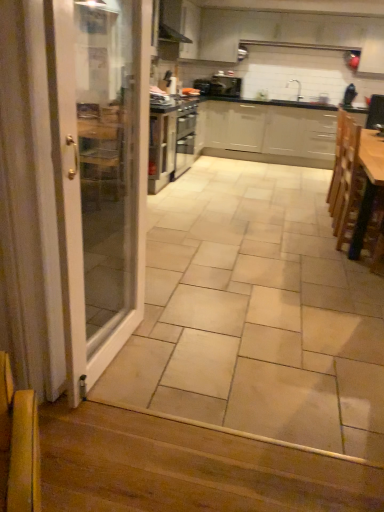
Question: Considering the relative sizes of black matte exhaust hood at upper center and wooden at lower left in the image provided, is black matte exhaust hood at upper center taller than wooden at lower left?

Choices:
 (A) no
 (B) yes

Answer: (B)

Question: Is black matte exhaust hood at upper center not inside wooden at lower left?

Choices:
 (A) no
 (B) yes

Answer: (B)

Question: Is black matte exhaust hood at upper center bigger than wooden at lower left?

Choices:
 (A) no
 (B) yes

Answer: (B)

Question: Is black matte exhaust hood at upper center next to wooden at lower left and touching it?

Choices:
 (A) no
 (B) yes

Answer: (A)

Question: Is black matte exhaust hood at upper center far from wooden at lower left?

Choices:
 (A) no
 (B) yes

Answer: (B)

Question: From their relative heights in the image, would you say beige ceramic tile at center is taller or shorter than wooden armchair at lower left?

Choices:
 (A) short
 (B) tall

Answer: (A)

Question: From the image's perspective, is beige ceramic tile at center positioned above or below wooden armchair at lower left?

Choices:
 (A) above
 (B) below

Answer: (A)

Question: Does point (370, 356) appear closer or farther from the camera than point (23, 437)?

Choices:
 (A) farther
 (B) closer

Answer: (A)

Question: Considering the positions of beige ceramic tile at center and wooden armchair at lower left in the image, is beige ceramic tile at center wider or thinner than wooden armchair at lower left?

Choices:
 (A) thin
 (B) wide

Answer: (B)

Question: Considering the positions of wooden armchair at lower left and black matte exhaust hood at upper center in the image, is wooden armchair at lower left taller or shorter than black matte exhaust hood at upper center?

Choices:
 (A) tall
 (B) short

Answer: (B)

Question: From the image's perspective, relative to black matte exhaust hood at upper center, is wooden armchair at lower left above or below?

Choices:
 (A) above
 (B) below

Answer: (B)

Question: Looking at the image, does wooden armchair at lower left seem bigger or smaller compared to black matte exhaust hood at upper center?

Choices:
 (A) small
 (B) big

Answer: (A)

Question: Considering the positions of wooden armchair at lower left and black matte exhaust hood at upper center in the image, is wooden armchair at lower left wider or thinner than black matte exhaust hood at upper center?

Choices:
 (A) thin
 (B) wide

Answer: (A)

Question: From the image's perspective, is wooden table at right above or below beige ceramic tile at center?

Choices:
 (A) below
 (B) above

Answer: (B)

Question: From a real-world perspective, relative to beige ceramic tile at center, is wooden table at right vertically above or below?

Choices:
 (A) above
 (B) below

Answer: (A)